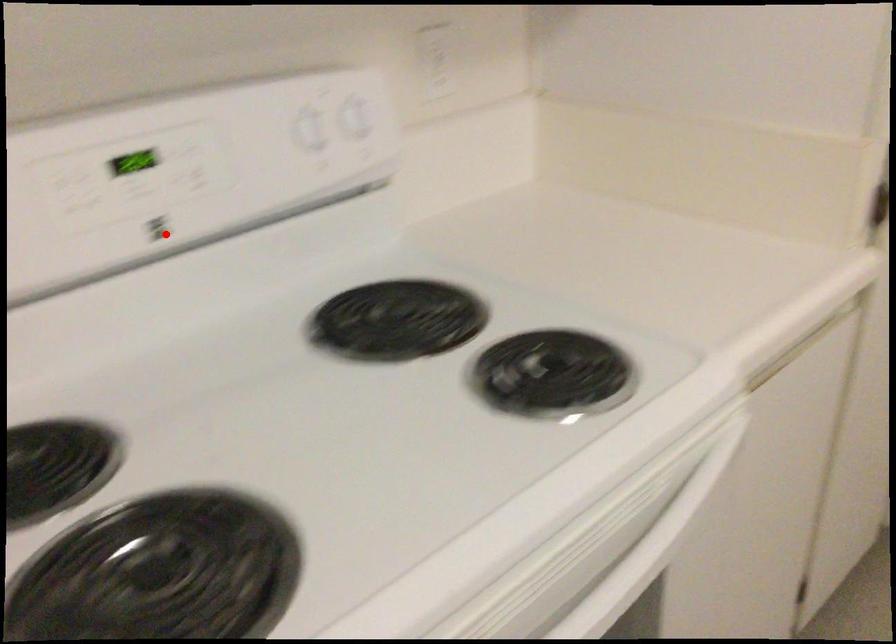
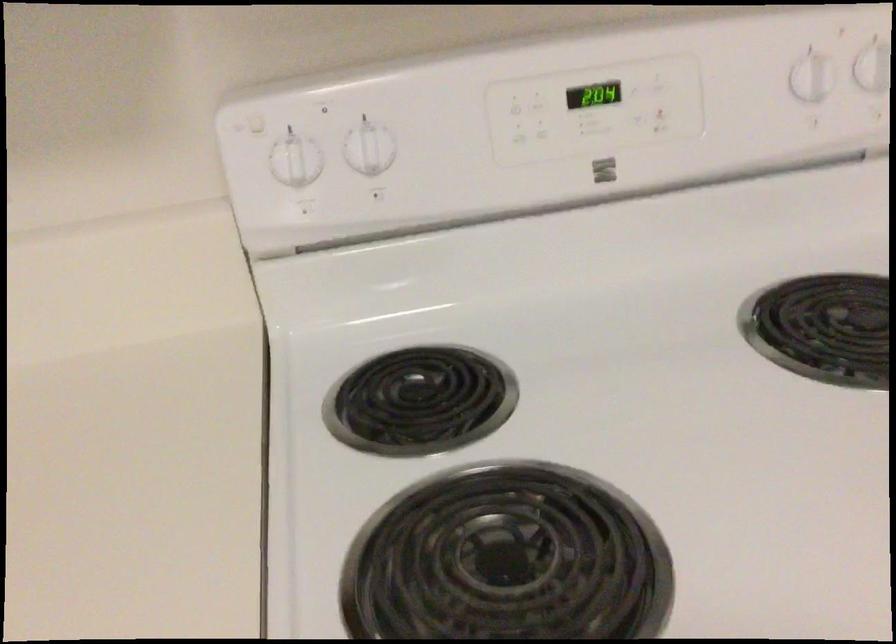
Locate, in the second image, the point that corresponds to the highlighted location in the first image.

(604, 169)